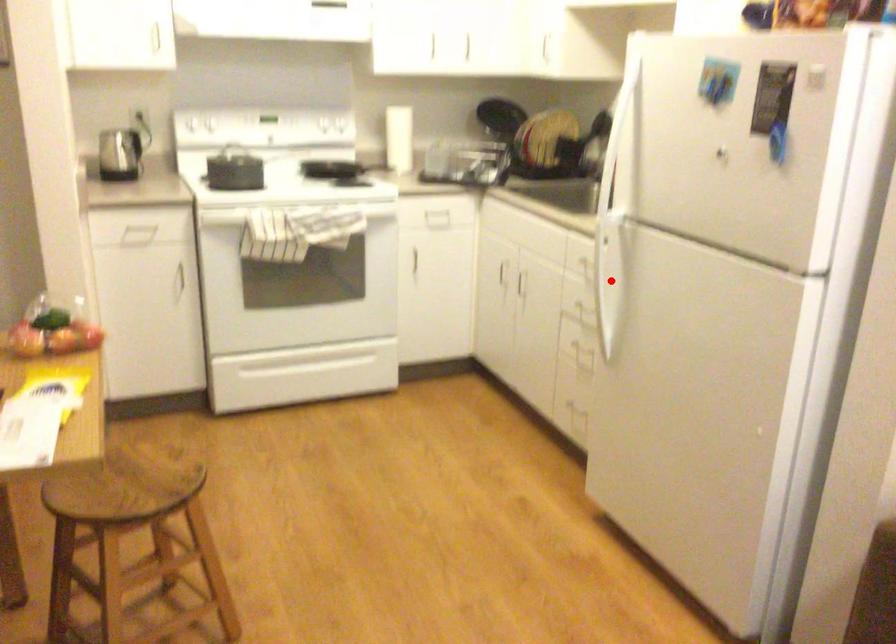
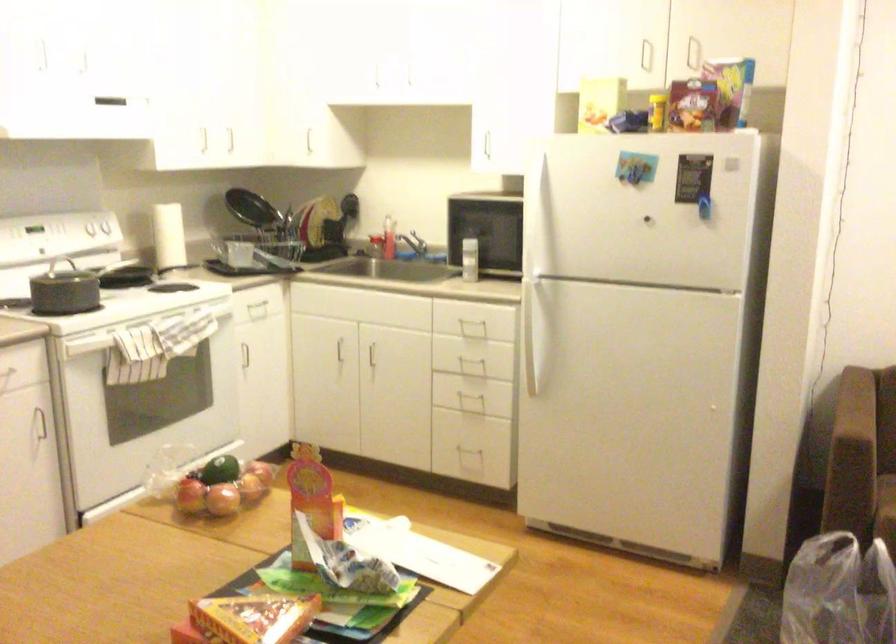
Find the pixel in the second image that matches the highlighted location in the first image.

(536, 328)